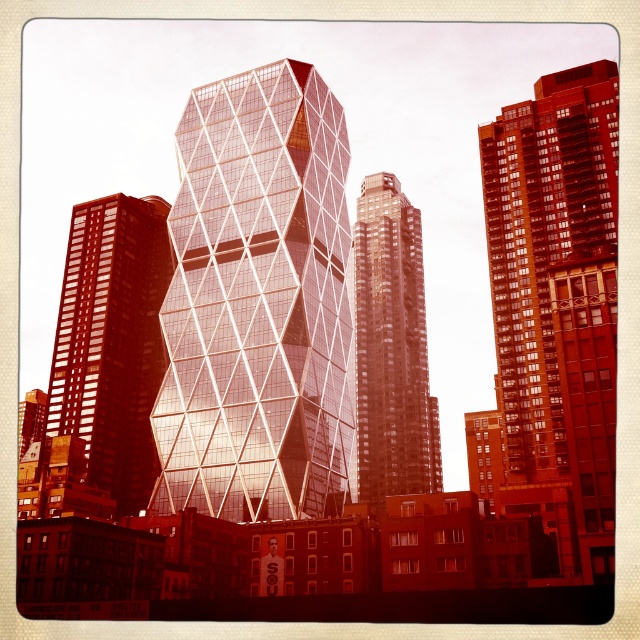
You are an architect analyzing the layout of the cityscape. Which structure, the matte glass building at right or the matte glass tower at left, appears to be closer to the foreground of the image?

The matte glass building at right is positioned over the matte glass tower at left, meaning it appears closer to the foreground.

Based on the photo, you are an architect reviewing a cityscape design. You notice two structures, the matte glass building at right and the matte glass tower at left. Based on their sizes, which one would require more materials for construction?

The matte glass building at right requires more materials for construction because it has a larger size compared to the matte glass tower at left.

You are an architect analyzing the layout of the city. You need to determine the exact position of the glassy reflective building at center in the image. What are its coordinates?

The glassy reflective building at center is located at coordinates point (257, 304).